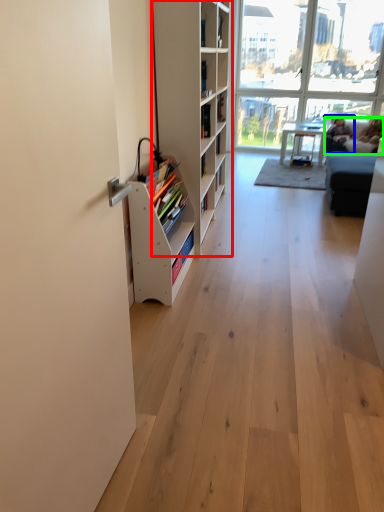
Question: Which object is positioned closest to shelf (highlighted by a red box)? Select from person (highlighted by a blue box) and couch (highlighted by a green box).

Choices:
 (A) person
 (B) couch

Answer: (B)